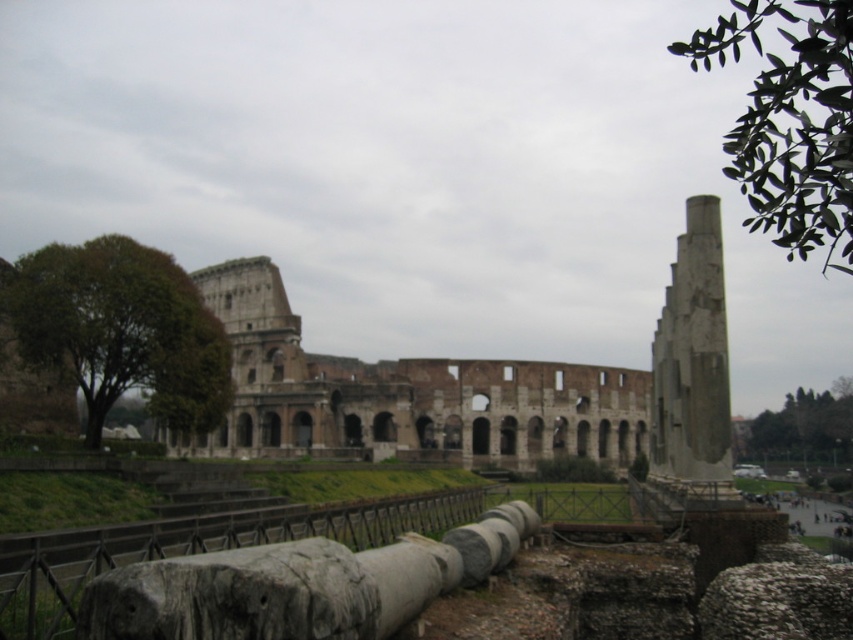
Question: Can you confirm if brown stone ruins at center is positioned to the right of gray stone column at right?

Choices:
 (A) no
 (B) yes

Answer: (A)

Question: Does brown stone ruins at center appear on the left side of gray stone column at right?

Choices:
 (A) no
 (B) yes

Answer: (B)

Question: Which point is closer to the camera?

Choices:
 (A) gray stone column at right
 (B) brown stone ruins at center

Answer: (A)

Question: Can you confirm if brown stone ruins at center is positioned to the left of gray stone column at right?

Choices:
 (A) no
 (B) yes

Answer: (B)

Question: Which of the following is the farthest from the observer?

Choices:
 (A) gray stone column at right
 (B) brown stone ruins at center

Answer: (B)

Question: Among these objects, which one is nearest to the camera?

Choices:
 (A) brown stone ruins at center
 (B) gray stone column at right

Answer: (B)